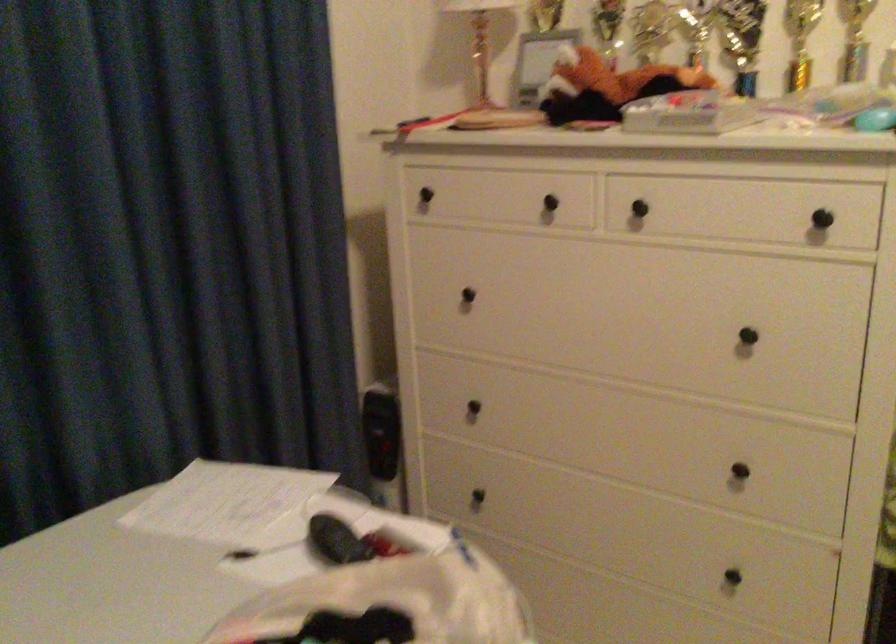
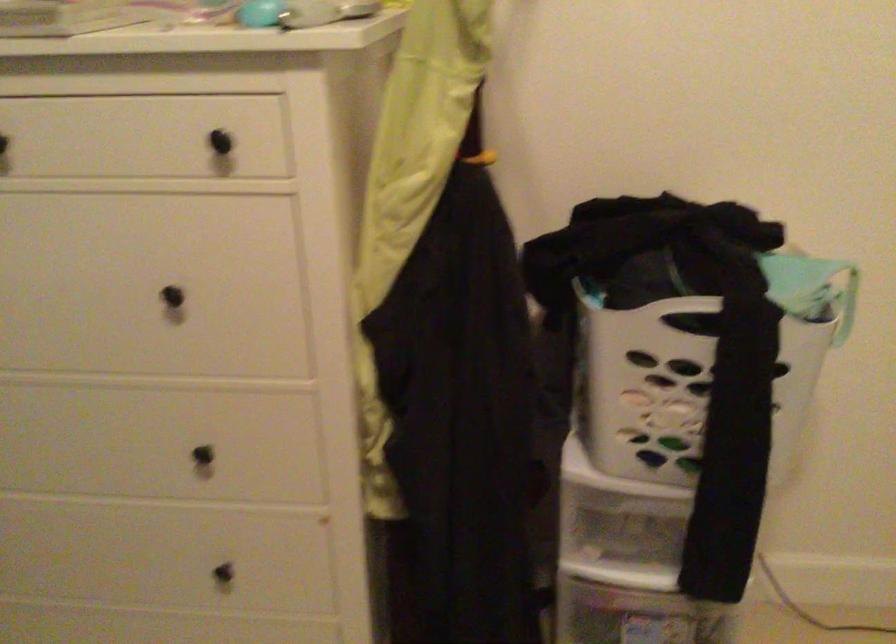
Locate, in the second image, the point that corresponds to point (746, 345) in the first image.

(178, 305)